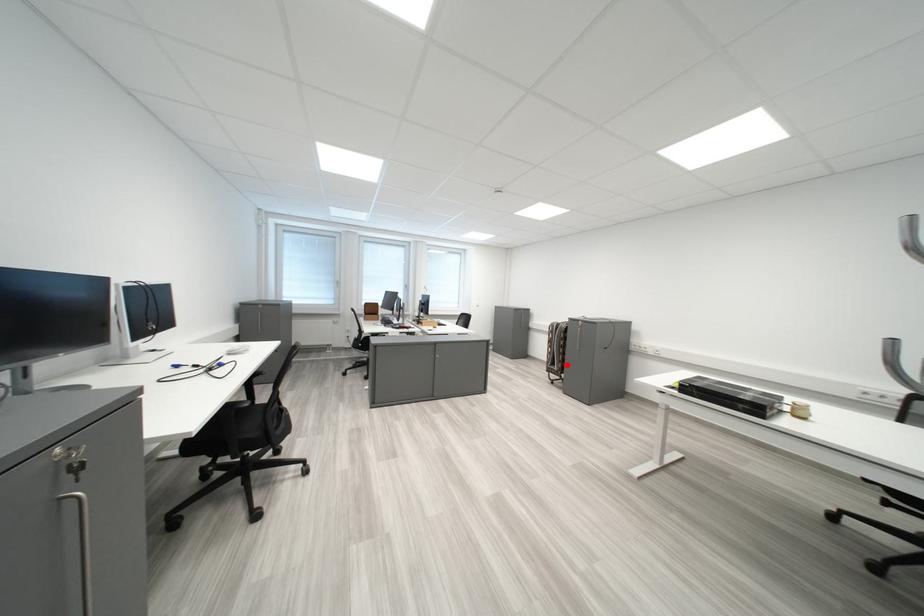
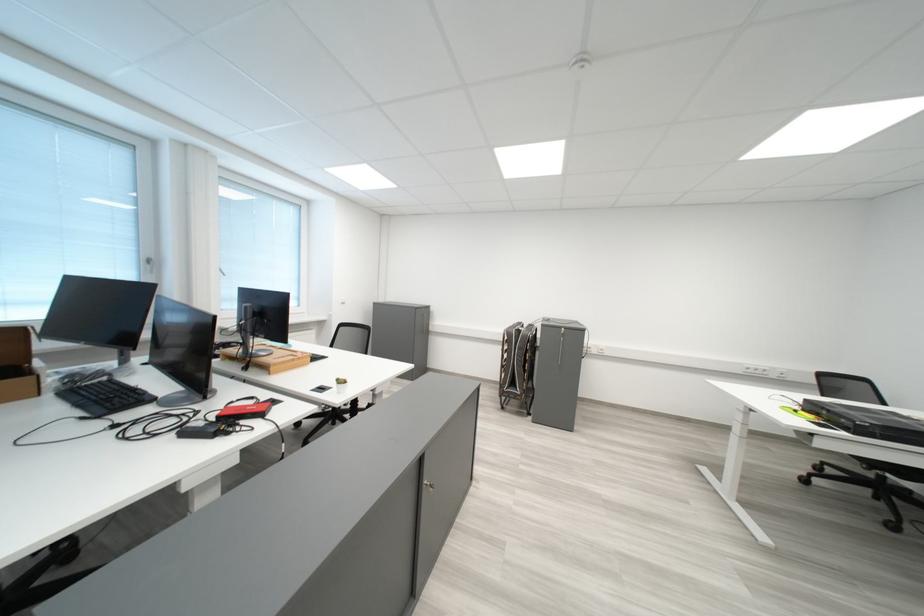
In the second image, find the point that corresponds to the highlighted location in the first image.

(526, 387)